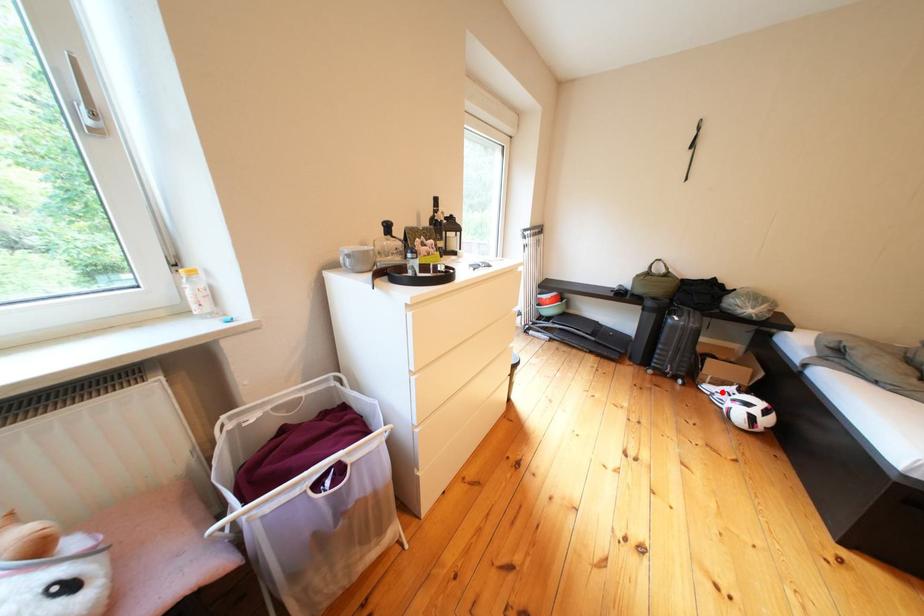
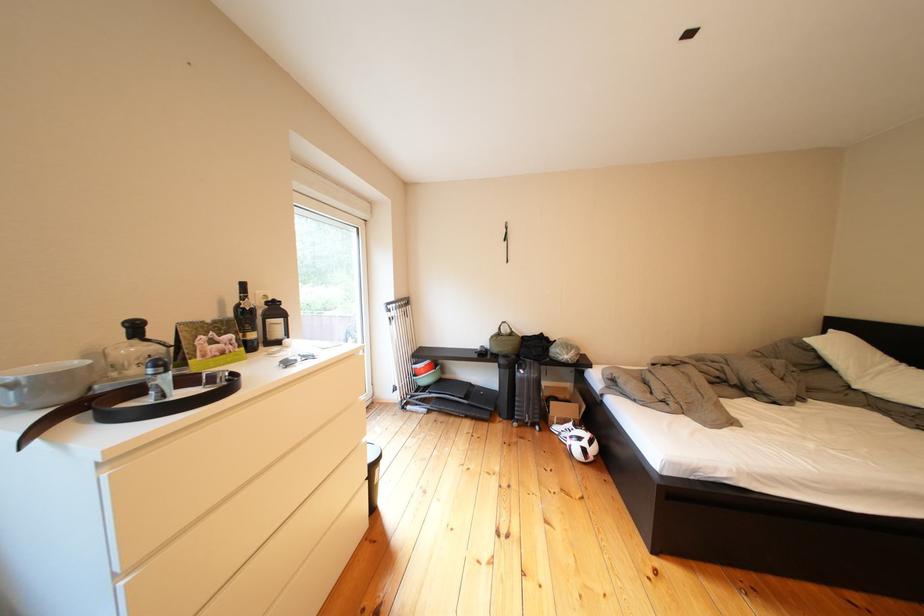
Question: I am providing you with two images of the same scene from different viewpoints. In image1, a red point is highlighted. Considering the same 3D point in image2, which of the following is correct?

Choices:
 (A) It is closer
 (B) It is farther

Answer: (B)